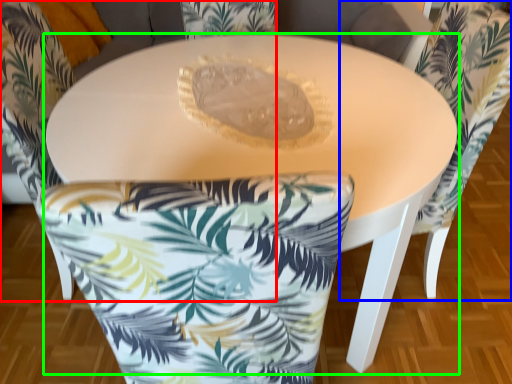
Question: Based on their relative distances, which object is nearer to chair (highlighted by a red box)? Choose from chair (highlighted by a blue box) and table (highlighted by a green box).

Choices:
 (A) chair
 (B) table

Answer: (B)